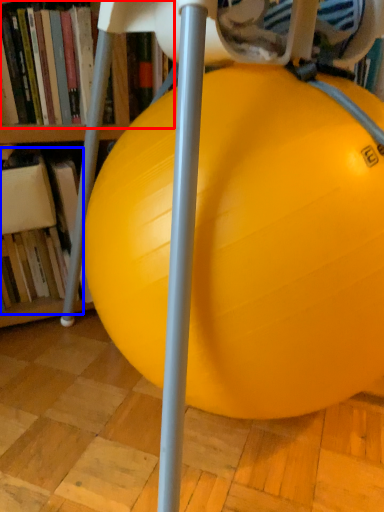
Question: Which object is further to the camera taking this photo, book (highlighted by a red box) or book (highlighted by a blue box)?

Choices:
 (A) book
 (B) book

Answer: (B)